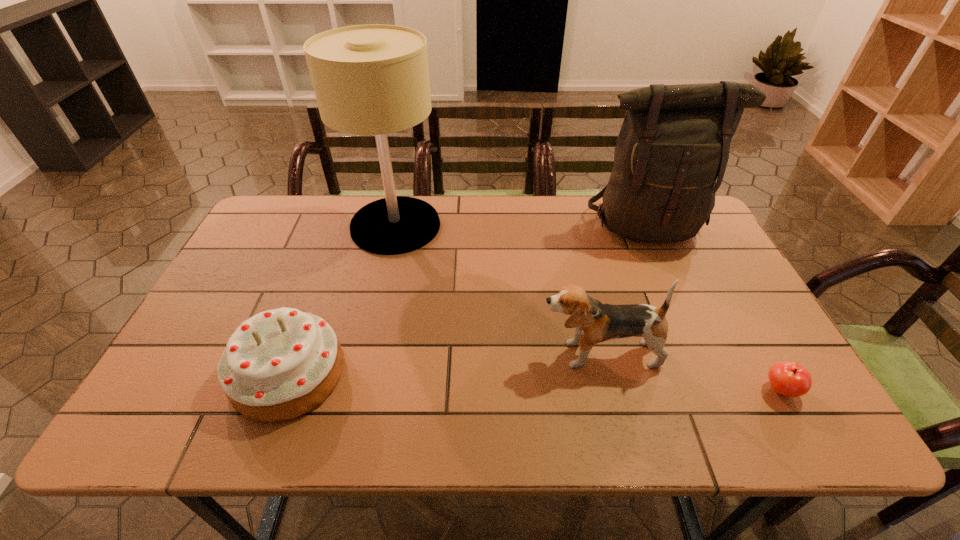
Find the location of a particular element. The width and height of the screenshot is (960, 540). vacant region that satisfies the following two spatial constraints: 1. on the open flap of the apple; 2. on the left side of the fourth shortest object is located at coordinates (720, 390).

Find the location of a particular element. The width and height of the screenshot is (960, 540). vacant area in the image that satisfies the following two spatial constraints: 1. on the open flap of the backpack; 2. on the right side of the shortest object is located at coordinates (720, 390).

Locate an element on the screen. The width and height of the screenshot is (960, 540). free space that satisfies the following two spatial constraints: 1. on the open flap of the apple; 2. on the right side of the backpack is located at coordinates (720, 390).

Where is `vacant region that satisfies the following two spatial constraints: 1. on the open flap of the shortest object; 2. on the right side of the backpack`? vacant region that satisfies the following two spatial constraints: 1. on the open flap of the shortest object; 2. on the right side of the backpack is located at coordinates (720, 390).